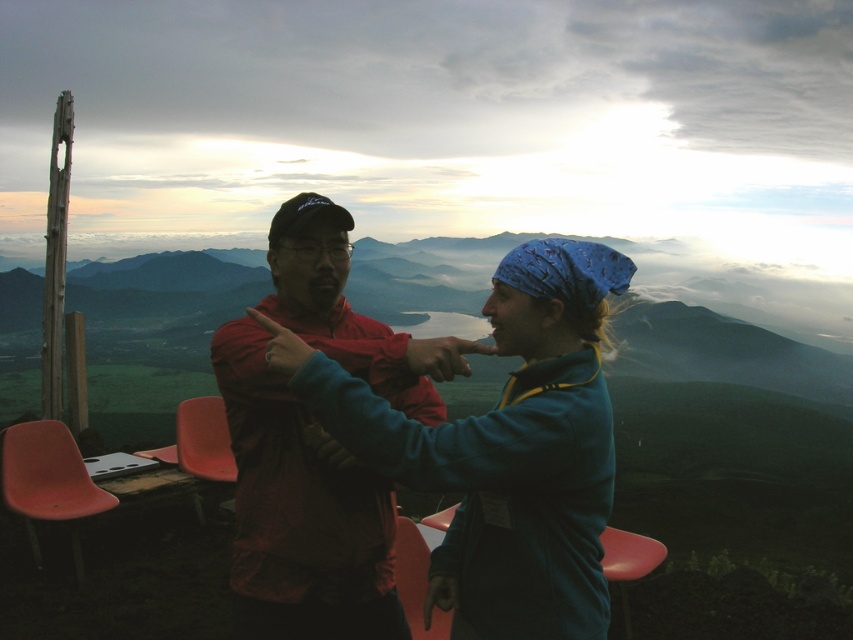
Which is in front, point (473, 436) or point (50, 460)?

Point (473, 436)

Image resolution: width=853 pixels, height=640 pixels. Describe the element at coordinates (503, 449) in the screenshot. I see `blue bandana at center` at that location.

Which is behind, point (611, 460) or point (68, 467)?

Positioned behind is point (68, 467).

Find the location of `blue bandana at center`. blue bandana at center is located at coordinates (503, 449).

Can you confirm if blue bandana at center is positioned to the left of matte plastic chair at lower center?

In fact, blue bandana at center is to the right of matte plastic chair at lower center.

Does blue bandana at center appear on the right side of matte plastic chair at lower center?

Yes, blue bandana at center is to the right of matte plastic chair at lower center.

Who is more distant from viewer, (x=352, y=417) or (x=405, y=522)?

Point (x=405, y=522)

The image size is (853, 640). What are the coordinates of `blue bandana at center` in the screenshot? It's located at (503, 449).

Between pink plastic chair at lower center and matte plastic chair at lower center, which one is positioned lower?

pink plastic chair at lower center

Identify the location of pink plastic chair at lower center. Image resolution: width=853 pixels, height=640 pixels. (628, 563).